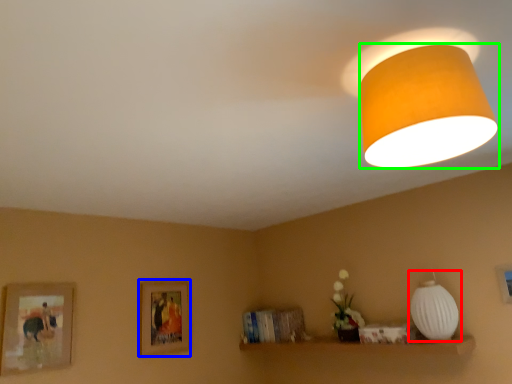
Question: Considering the real-world distances, which object is closest to lamp (highlighted by a red box)? picture frame (highlighted by a blue box) or lamp (highlighted by a green box).

Choices:
 (A) picture frame
 (B) lamp

Answer: (B)